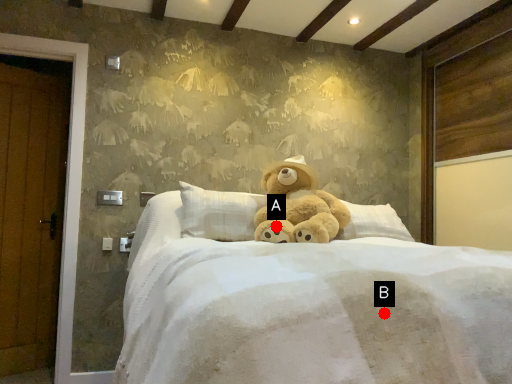
Question: Two points are circled on the image, labeled by A and B beside each circle. Which of the following is the closest to the observer?

Choices:
 (A) A is closer
 (B) B is closer

Answer: (B)